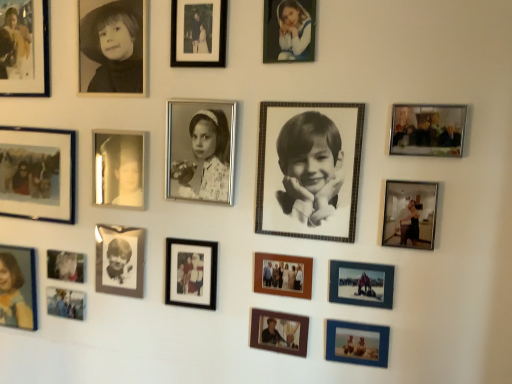
Question: Is point (309, 281) positioned closer to the camera than point (437, 152)?

Choices:
 (A) farther
 (B) closer

Answer: (A)

Question: Is wooden photo frame at center, positioned as the 5th picture frame in right-to-left order, inside the boundaries of metallic silver photo frame at upper right, which ranks as the first picture frame in right-to-left order, or outside?

Choices:
 (A) inside
 (B) outside

Answer: (B)

Question: Based on their relative distances, which object is farther from the metallic silver photo frame at lower left, acting as the 4th picture frame starting from the left?

Choices:
 (A) blue textured photo frame at lower right, which appears as the eleventh picture frame when viewed from the left
 (B) metallic silver photo frame at lower left, the twelfth picture frame positioned from the right
 (C) matte blue photo frame at lower center, the 12th picture frame from the left
 (D) black glossy photo frame at center-left, which appears as the 3th person when viewed from the left
 (E) black glossy photo frame at lower left, which is counted as the 10th picture frame, starting from the right

Answer: (A)

Question: Which is farther from the wooden photo frame at center, placed as the 9th picture frame when sorted from left to right?

Choices:
 (A) metallic silver photo frame at lower left, placed as the eleventh picture frame when sorted from right to left
 (B) matte black photo frame at upper left, acting as the 1th picture frame starting from the left
 (C) matte blue dress at bottom left, placed as the 1th person when sorted from left to right
 (D) matte black photo frame at center, acting as the 8th picture frame starting from the right
 (E) matte white dress at upper center, marked as the 4th person in a left-to-right arrangement

Answer: (B)